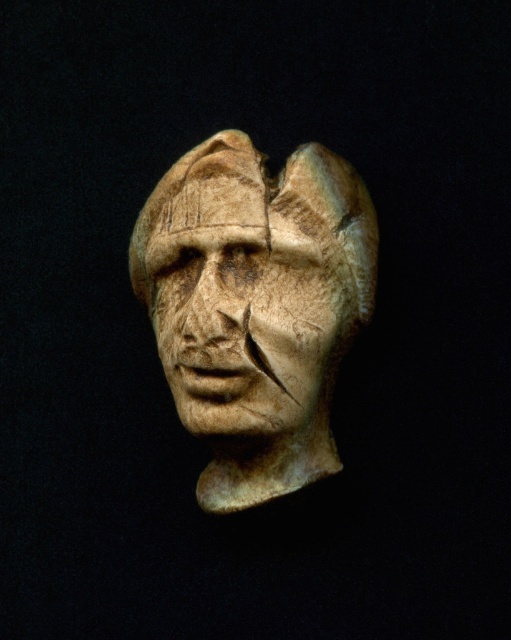
You are standing 5 feet away from the carved stone head in the image. There is a point at coordinates point (335, 225) on the sculpture. Can you reach this point without moving closer than your current position?

The distance of point (335, 225) from viewer is 4.35 feet, so yes, you can reach this point without moving closer since you are currently 5 feet away, which is farther than the point.

You are an archaeologist examining the image of an ancient sculpture. You notice two features labeled as the beige stone head at center and the carved stone face at center. Based on the scene described, which of these two features is bigger in size?

The beige stone head at center is larger in size than the carved stone face at center according to the description.

Where is the beige stone head at center located in the image?

The beige stone head at center is located at point coordinates of approximately 0.480 on the x axis and 0.501 on the y axis.